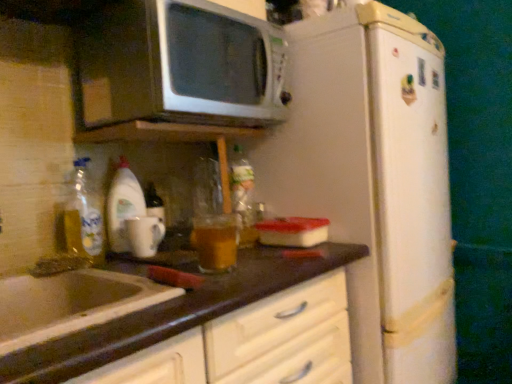
The image size is (512, 384). Find the location of `vacant space in front of translucent plastic bottle at center`. vacant space in front of translucent plastic bottle at center is located at coordinates (238, 242).